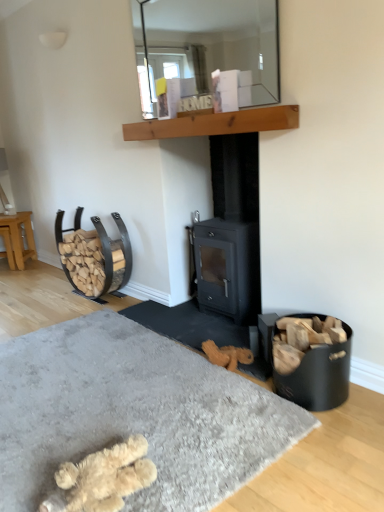
Question: Is fuzzy beige slippers at lower left to the left of fluffy beige slippers at lower center from the viewer's perspective?

Choices:
 (A) no
 (B) yes

Answer: (A)

Question: Considering the relative sizes of fuzzy beige slippers at lower left and fluffy beige slippers at lower center in the image provided, is fuzzy beige slippers at lower left wider than fluffy beige slippers at lower center?

Choices:
 (A) no
 (B) yes

Answer: (A)

Question: From a real-world perspective, is fuzzy beige slippers at lower left located higher than fluffy beige slippers at lower center?

Choices:
 (A) yes
 (B) no

Answer: (A)

Question: Is fuzzy beige slippers at lower left aimed at fluffy beige slippers at lower center?

Choices:
 (A) no
 (B) yes

Answer: (A)

Question: Is fuzzy beige slippers at lower left outside of fluffy beige slippers at lower center?

Choices:
 (A) yes
 (B) no

Answer: (A)

Question: Does fuzzy beige slippers at lower left have a larger size compared to fluffy beige slippers at lower center?

Choices:
 (A) no
 (B) yes

Answer: (A)

Question: Does black matte wood burning stove at center have a lesser width compared to wooden at upper center?

Choices:
 (A) no
 (B) yes

Answer: (A)

Question: Are black matte wood burning stove at center and wooden at upper center making contact?

Choices:
 (A) yes
 (B) no

Answer: (B)

Question: Can you confirm if black matte wood burning stove at center is wider than wooden at upper center?

Choices:
 (A) no
 (B) yes

Answer: (B)

Question: Would you say black matte wood burning stove at center is a long distance from wooden at upper center?

Choices:
 (A) no
 (B) yes

Answer: (A)

Question: From a real-world perspective, is black matte wood burning stove at center over wooden at upper center?

Choices:
 (A) no
 (B) yes

Answer: (A)

Question: From the image's perspective, is black matte wood burning stove at center over wooden at upper center?

Choices:
 (A) yes
 (B) no

Answer: (B)

Question: Does light brown wooden stool at left have a smaller size compared to clear glass mirror at upper center?

Choices:
 (A) no
 (B) yes

Answer: (A)